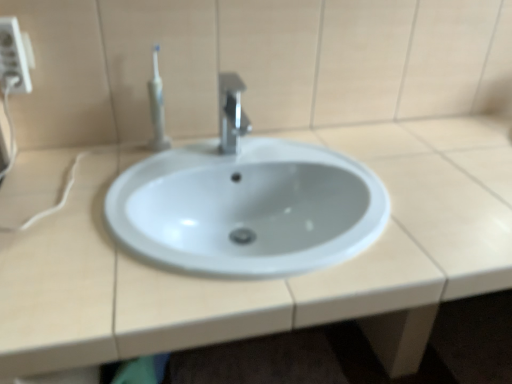
Where is `empty space that is to the right of polished metallic faucet at center`? The height and width of the screenshot is (384, 512). empty space that is to the right of polished metallic faucet at center is located at coordinates (309, 162).